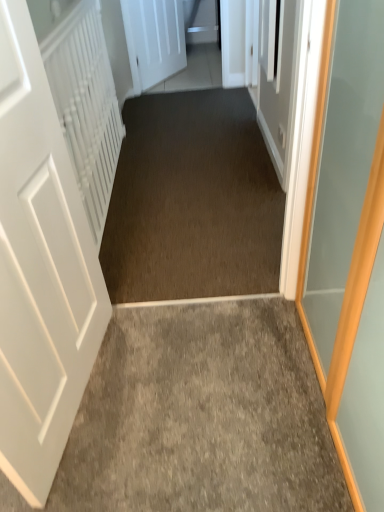
Question: Is white textured radiator at left inside gray carpet at center?

Choices:
 (A) yes
 (B) no

Answer: (B)

Question: Is there a large distance between gray carpet at center and white textured radiator at left?

Choices:
 (A) yes
 (B) no

Answer: (A)

Question: Considering the relative sizes of gray carpet at center and white textured radiator at left in the image provided, is gray carpet at center smaller than white textured radiator at left?

Choices:
 (A) no
 (B) yes

Answer: (B)

Question: Is white textured radiator at left at the back of gray carpet at center?

Choices:
 (A) yes
 (B) no

Answer: (B)

Question: Can you confirm if gray carpet at center is wider than white textured radiator at left?

Choices:
 (A) yes
 (B) no

Answer: (A)

Question: From their relative heights in the image, would you say white textured radiator at left is taller or shorter than gray carpet at center?

Choices:
 (A) short
 (B) tall

Answer: (B)

Question: In terms of size, does white textured radiator at left appear bigger or smaller than gray carpet at center?

Choices:
 (A) big
 (B) small

Answer: (A)

Question: From the image's perspective, relative to gray carpet at center, is white textured radiator at left above or below?

Choices:
 (A) above
 (B) below

Answer: (A)

Question: In terms of width, does white textured radiator at left look wider or thinner when compared to gray carpet at center?

Choices:
 (A) thin
 (B) wide

Answer: (A)

Question: Considering the positions of gray carpet at center and white matte door at upper center, which is the first door in back-to-front order, in the image, is gray carpet at center bigger or smaller than white matte door at upper center, which is the first door in back-to-front order,?

Choices:
 (A) big
 (B) small

Answer: (B)

Question: Considering the positions of gray carpet at center and white matte door at upper center, acting as the 1th door starting from the top, in the image, is gray carpet at center taller or shorter than white matte door at upper center, acting as the 1th door starting from the top,?

Choices:
 (A) short
 (B) tall

Answer: (A)

Question: From the image's perspective, is gray carpet at center located above or below white matte door at upper center, acting as the 1th door starting from the top?

Choices:
 (A) below
 (B) above

Answer: (A)

Question: Considering the positions of point (178, 439) and point (152, 0), is point (178, 439) closer or farther from the camera than point (152, 0)?

Choices:
 (A) farther
 (B) closer

Answer: (B)

Question: Is point (240, 155) closer or farther from the camera than point (67, 29)?

Choices:
 (A) closer
 (B) farther

Answer: (B)

Question: Considering their positions, is dark brown carpet at center located in front of or behind white textured radiator at left?

Choices:
 (A) behind
 (B) front

Answer: (A)